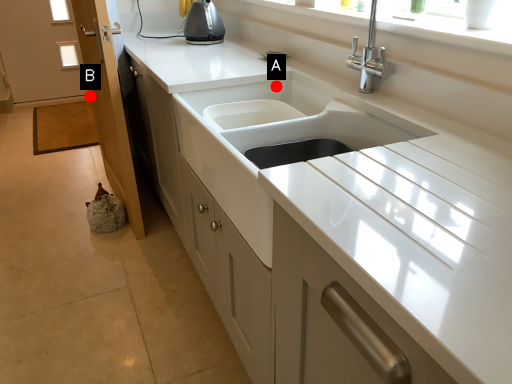
Question: Two points are circled on the image, labeled by A and B beside each circle. Which point is further to the camera?

Choices:
 (A) A is further
 (B) B is further

Answer: (B)